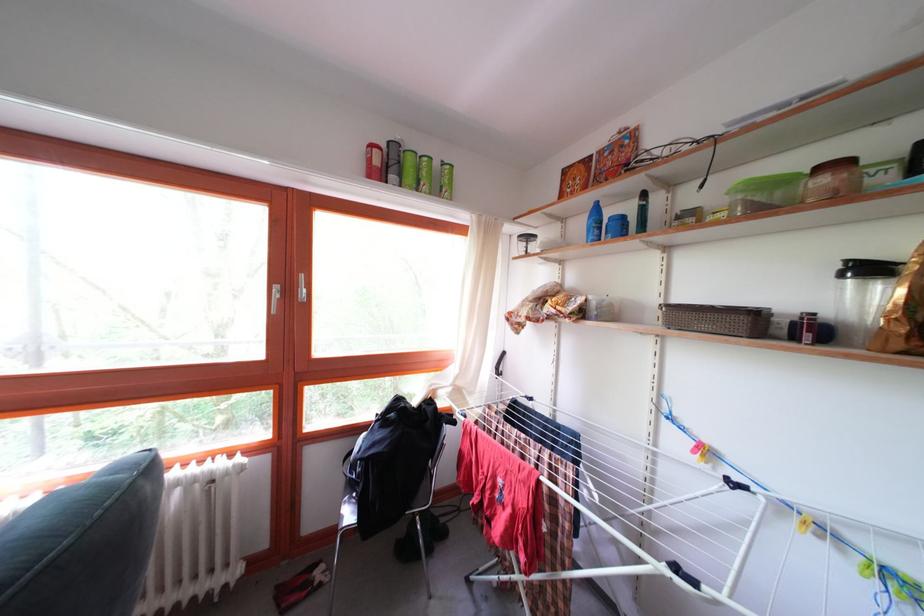
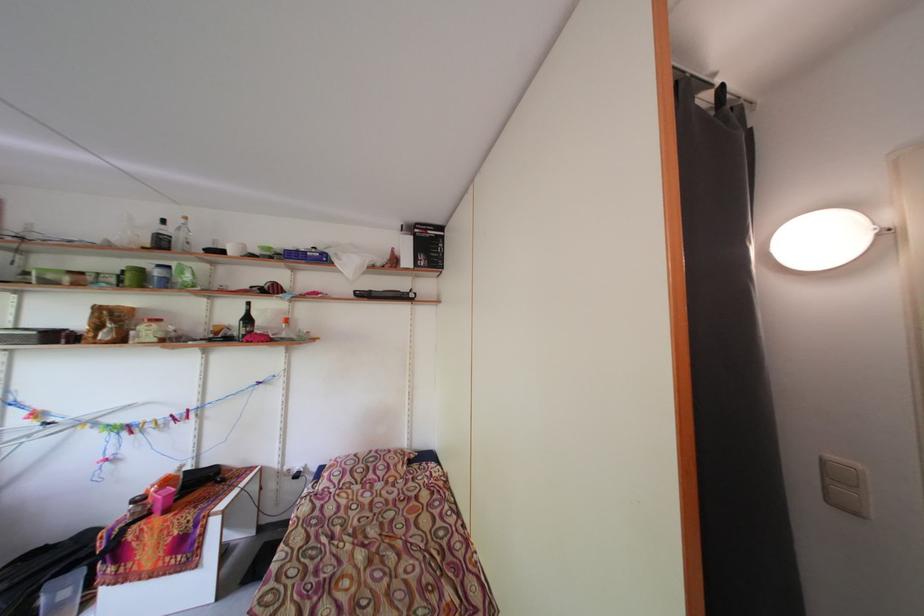
In the second image, find the point that corresponds to (x=883, y=136) in the first image.

(127, 265)